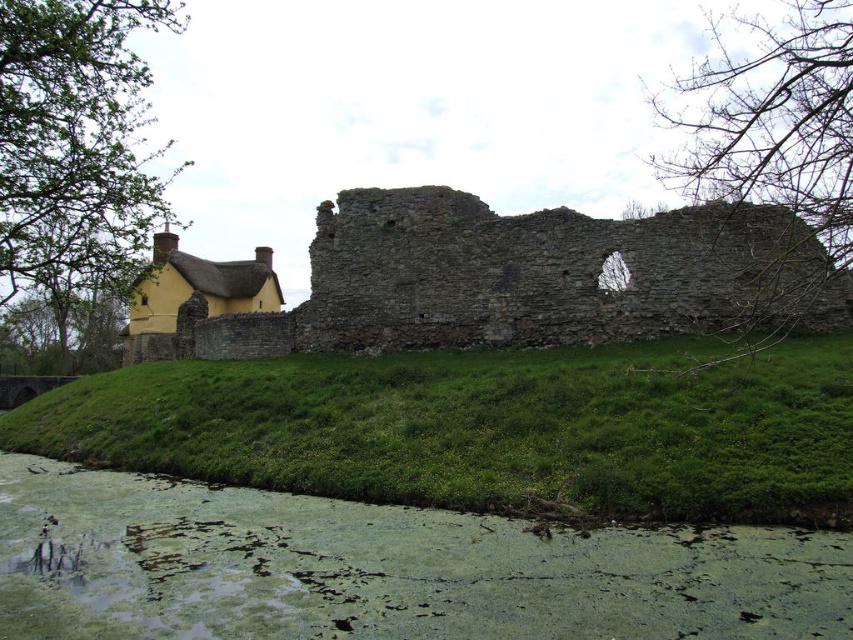
Question: Which point appears farthest from the camera in this image?

Choices:
 (A) (329, 396)
 (B) (309, 348)

Answer: (B)

Question: Does green grassy hillside at lower left come in front of rustic stone wall at center?

Choices:
 (A) yes
 (B) no

Answer: (A)

Question: Which point is closer to the camera?

Choices:
 (A) rustic stone wall at center
 (B) green grassy hillside at lower left

Answer: (B)

Question: Can you confirm if green grassy hillside at lower left is positioned to the right of rustic stone wall at center?

Choices:
 (A) yes
 (B) no

Answer: (A)

Question: Is green grassy hillside at lower left to the right of rustic stone wall at center from the viewer's perspective?

Choices:
 (A) yes
 (B) no

Answer: (A)